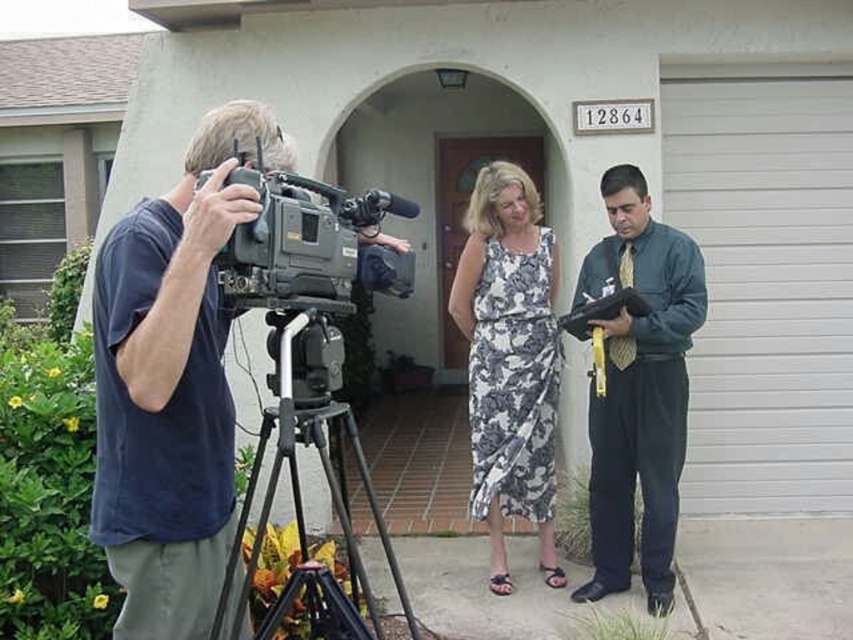
Which is behind, point (666, 436) or point (492, 506)?

The point (492, 506) is behind.

Where is `green shirt at right`? green shirt at right is located at coordinates click(x=637, y=388).

You are a GUI agent. You are given a task and a screenshot of the screen. Output one action in this format:
    pyautogui.click(x=<x>, y=<y>)
    Task: Click on the green shirt at right
    The width and height of the screenshot is (853, 640).
    Given the screenshot: What is the action you would take?
    pyautogui.click(x=637, y=388)

Is green shirt at right positioned behind black metal tripod at left?

Yes, it is.

I want to click on green shirt at right, so click(637, 388).

Between point (503, 436) and point (407, 202), which one is positioned behind?

The point (503, 436) is more distant.

Is floral-patterned dress at center taller than black plastic video camera at left?

Yes, floral-patterned dress at center is taller than black plastic video camera at left.

The height and width of the screenshot is (640, 853). Describe the element at coordinates (509, 360) in the screenshot. I see `floral-patterned dress at center` at that location.

Where is `floral-patterned dress at center`? Image resolution: width=853 pixels, height=640 pixels. floral-patterned dress at center is located at coordinates (509, 360).